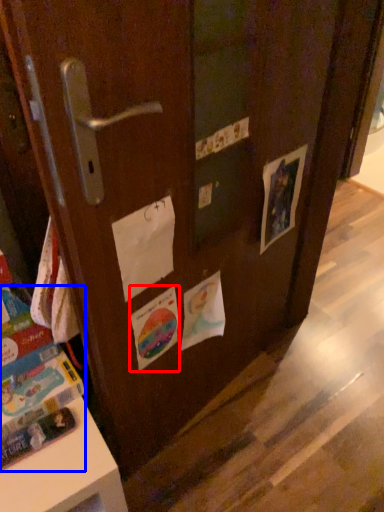
Question: Among these objects, which one is farthest to the camera, flyer (highlighted by a red box) or book (highlighted by a blue box)?

Choices:
 (A) flyer
 (B) book

Answer: (A)